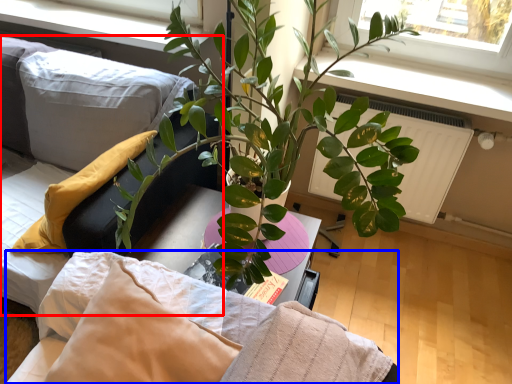
Question: Among these objects, which one is farthest to the camera, couch (highlighted by a red box) or bedding (highlighted by a blue box)?

Choices:
 (A) couch
 (B) bedding

Answer: (A)